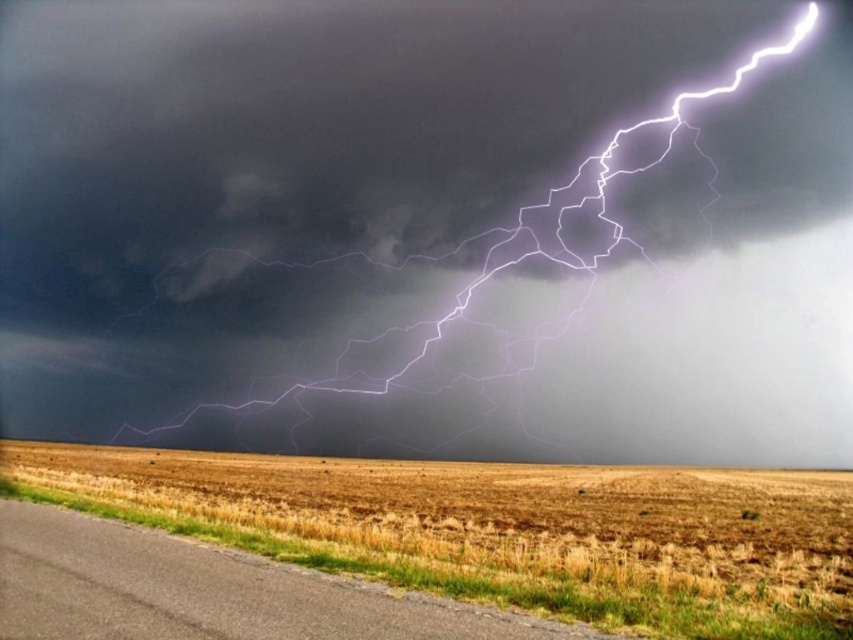
Question: In this image, where is white lightning at upper right located relative to dry grass at lower left?

Choices:
 (A) right
 (B) left

Answer: (B)

Question: Does white lightning at upper right appear on the right side of dry grass at lower left?

Choices:
 (A) yes
 (B) no

Answer: (B)

Question: Which object is closer to the camera taking this photo?

Choices:
 (A) dry grass at lower left
 (B) white lightning at upper right

Answer: (A)

Question: Which point is farther to the camera?

Choices:
 (A) (734, 483)
 (B) (450, 412)

Answer: (B)

Question: Among these objects, which one is farthest from the camera?

Choices:
 (A) white lightning at upper right
 (B) dry grass at lower left

Answer: (A)

Question: Is white lightning at upper right to the left of dry grass at lower left from the viewer's perspective?

Choices:
 (A) no
 (B) yes

Answer: (B)